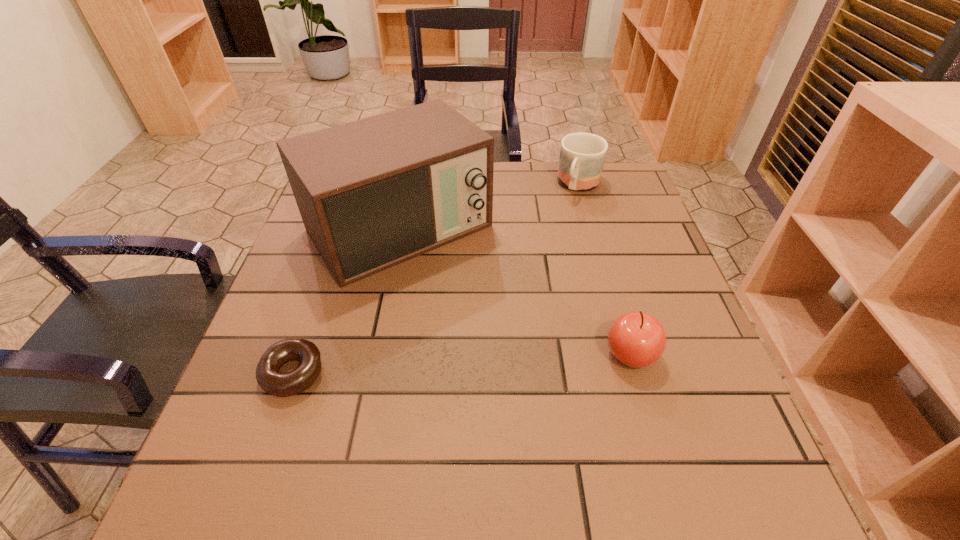
The height and width of the screenshot is (540, 960). Identify the location of the shortest object. (276, 383).

This screenshot has height=540, width=960. In order to click on apple in this screenshot , I will do `click(636, 339)`.

Find the location of a particular element. The width and height of the screenshot is (960, 540). radio receiver is located at coordinates (372, 193).

The height and width of the screenshot is (540, 960). What are the coordinates of `mug` in the screenshot? It's located at (582, 155).

Locate an element on the screen. This screenshot has width=960, height=540. vacant space situated 0.070m on the front of the shortest object is located at coordinates (271, 438).

At what (x,y) coordinates should I click in order to perform the action: click on vacant area situated on the back of the apple. Please return your answer as a coordinate pair (x, y). This screenshot has width=960, height=540. Looking at the image, I should click on (597, 238).

In order to click on vacant space located 0.190m on the front-facing side of the radio receiver in this screenshot , I will do click(493, 333).

Locate an element on the screen. The width and height of the screenshot is (960, 540). free space located on the front-facing side of the radio receiver is located at coordinates (460, 293).

Locate an element on the screen. vacant area situated 0.270m on the front-facing side of the radio receiver is located at coordinates (516, 360).

Identify the location of vacant area located 0.060m on the side with the handle of the mug. This screenshot has height=540, width=960. (567, 212).